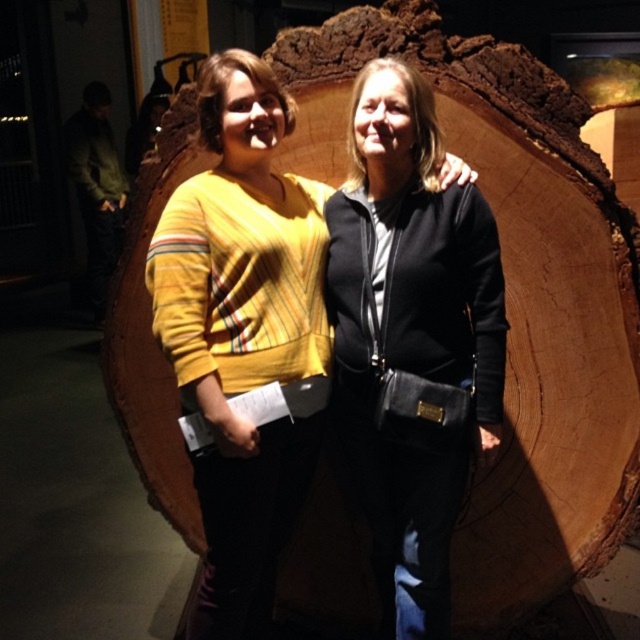
Question: Is black leather jacket at center wider than matte yellow sweater at center?

Choices:
 (A) no
 (B) yes

Answer: (A)

Question: Can you confirm if black leather jacket at center is positioned above matte yellow sweater at center?

Choices:
 (A) no
 (B) yes

Answer: (A)

Question: Is black leather jacket at center in front of matte yellow sweater at center?

Choices:
 (A) yes
 (B) no

Answer: (B)

Question: Which point appears closest to the camera in this image?

Choices:
 (A) coord(216,259)
 (B) coord(356,436)

Answer: (A)

Question: Which point is farther to the camera?

Choices:
 (A) matte yellow sweater at center
 (B) black leather jacket at center

Answer: (B)

Question: Which of the following is the farthest from the observer?

Choices:
 (A) matte yellow sweater at center
 (B) black leather jacket at center

Answer: (B)